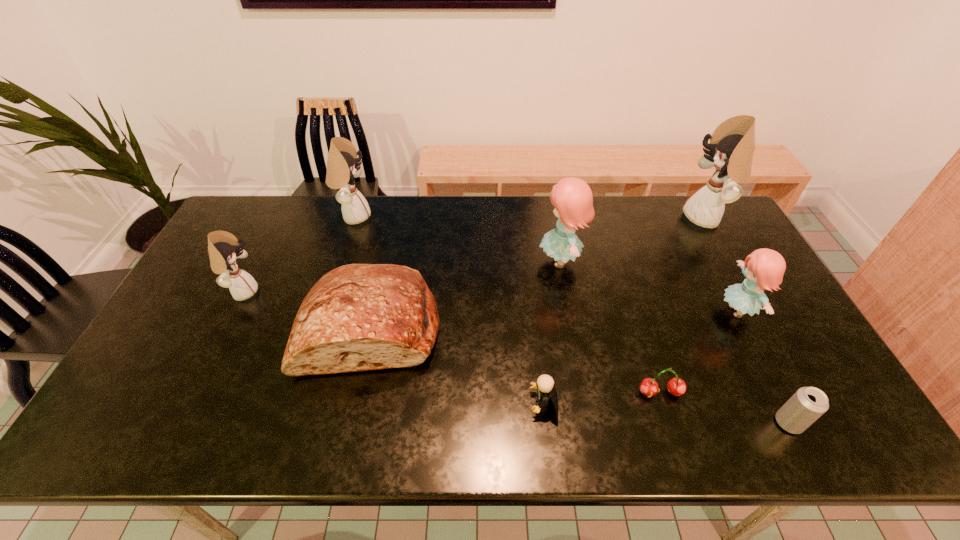
In order to click on free space at the right edge of the desktop in this screenshot , I will do `click(752, 331)`.

In the image, there is a desktop. Find the location of `vacant space at the far right corner`. vacant space at the far right corner is located at coordinates (683, 201).

Find the location of `blank region between the red cherry and the left blue doll`. blank region between the red cherry and the left blue doll is located at coordinates (611, 327).

The width and height of the screenshot is (960, 540). What are the coordinates of `free point between the biggest black doll and the Lego` in the screenshot? It's located at (625, 310).

The width and height of the screenshot is (960, 540). Find the location of `vacant space that is in between the second black doll from left to right and the white beer can`. vacant space that is in between the second black doll from left to right and the white beer can is located at coordinates (571, 320).

Locate an element on the screen. The width and height of the screenshot is (960, 540). free spot between the Lego and the beer can is located at coordinates pyautogui.click(x=666, y=413).

The height and width of the screenshot is (540, 960). I want to click on empty space that is in between the left blue doll and the second biggest black doll, so click(x=457, y=239).

This screenshot has height=540, width=960. What are the coordinates of `blank region between the fourth shortest object and the white beer can` in the screenshot? It's located at (580, 375).

Where is `free point between the nearest black doll and the red cherry`? The height and width of the screenshot is (540, 960). free point between the nearest black doll and the red cherry is located at coordinates (451, 342).

Identify the location of vacant space in between the right blue doll and the beer can. (763, 367).